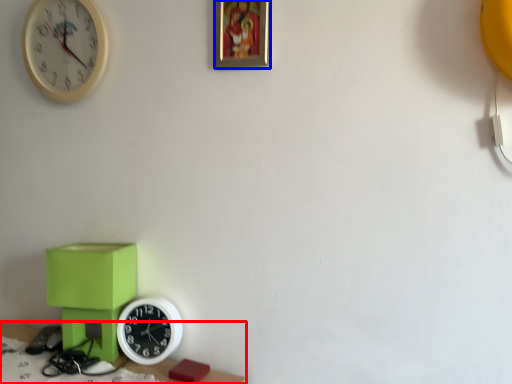
Question: Which point is closer to the camera, table (highlighted by a red box) or picture frame (highlighted by a blue box)?

Choices:
 (A) table
 (B) picture frame

Answer: (A)